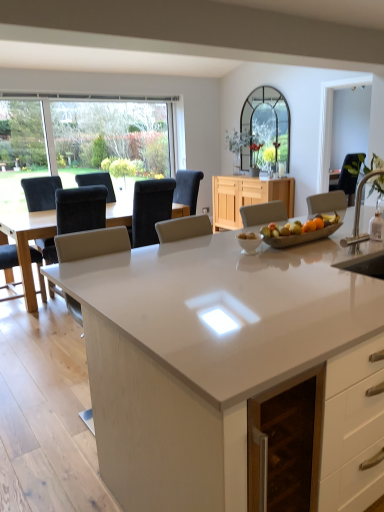
At what (x,y) coordinates should I click in order to perform the action: click on free space that is to the left of white glossy bowl at center. Please return your answer as a coordinate pair (x, y). Looking at the image, I should click on (214, 252).